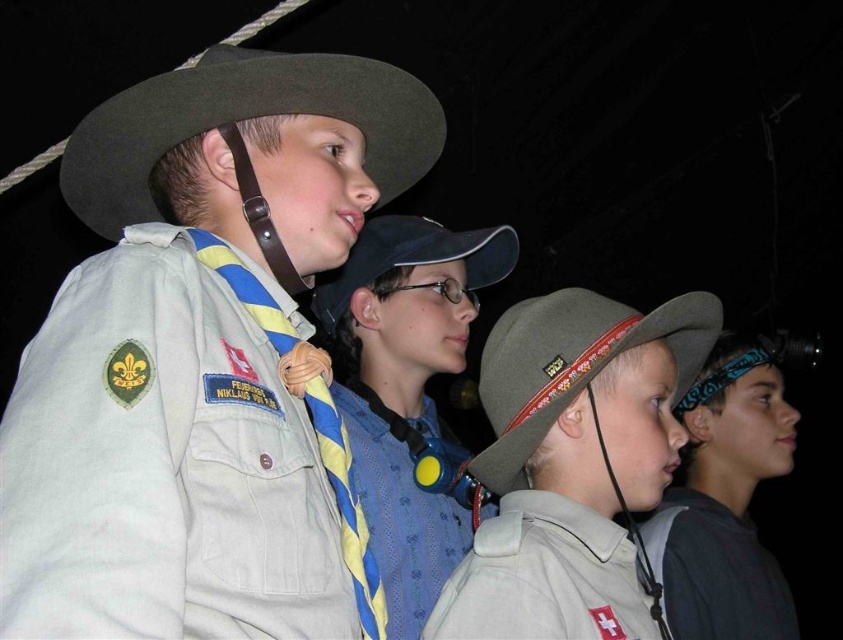
You are a photographer trying to capture a group photo of the scouts. The matte khaki uniform at center and the green felt cowboy hat at upper left are two key elements in the frame. Based on their sizes, which object would you need to position closer to the camera to make them appear the same size in the photo?

The matte khaki uniform at center is smaller in width than the green felt cowboy hat at upper left. To make them appear the same size in the photo, you should move the matte khaki uniform at center closer to the camera since it is naturally smaller and needs to be magnified to match the size of the larger green felt cowboy hat at upper left.

You are a photographer setting up for a group photo. You need to ensure that the matte khaki uniform at center and the blue fabric headband at right are both visible in the frame. Given their height difference, which object will require you to adjust your camera angle upwards to include it fully?

The matte khaki uniform at center has a greater height compared to the blue fabric headband at right, so you will need to adjust your camera angle upwards to include the matte khaki uniform at center fully.